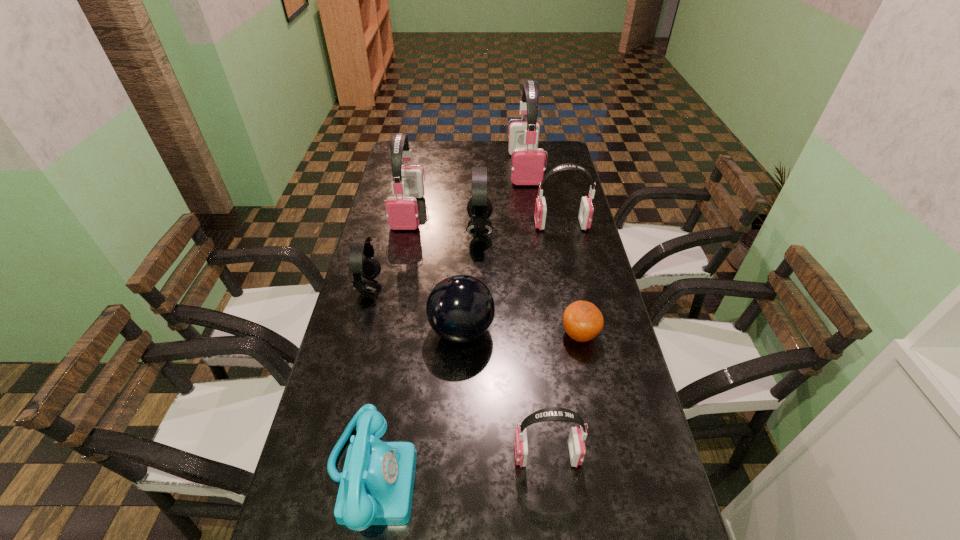
This screenshot has height=540, width=960. I want to click on the nearest earphone, so click(577, 451).

What are the coordinates of `the nearest pink earphone` in the screenshot? It's located at (577, 451).

Find the location of a particular element. This screenshot has height=540, width=960. orange is located at coordinates (582, 320).

Find the location of a particular element. orange orange is located at coordinates (582, 320).

I want to click on blank space located on the outer surface of the farthest earphone, so click(x=529, y=198).

The image size is (960, 540). I want to click on free region located 0.050m on the outer surface of the fifth shortest earphone, so click(402, 240).

Locate an element on the screen. free spot located 0.160m on the ear cups of the bigger black earphone is located at coordinates tap(538, 230).

Image resolution: width=960 pixels, height=540 pixels. I want to click on vacant space located on the outer surface of the second smallest pink earphone, so click(521, 225).

Where is `vacant area situated on the outer surface of the second smallest pink earphone`? This screenshot has height=540, width=960. vacant area situated on the outer surface of the second smallest pink earphone is located at coordinates (446, 225).

Where is `vacant point located on the outer surface of the second smallest pink earphone`? This screenshot has height=540, width=960. vacant point located on the outer surface of the second smallest pink earphone is located at coordinates (433, 225).